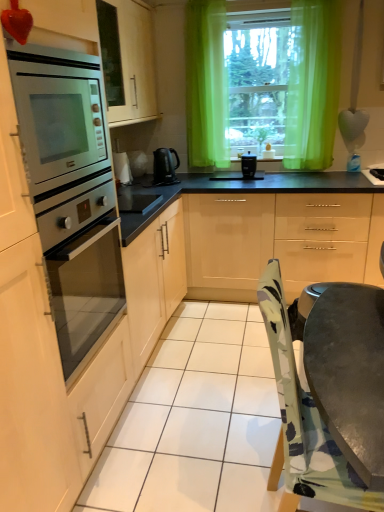
Question: Is green sheer curtains at upper center oriented away from black plastic coffee maker at center?

Choices:
 (A) yes
 (B) no

Answer: (B)

Question: Does green sheer curtains at upper center have a smaller size compared to black plastic coffee maker at center?

Choices:
 (A) no
 (B) yes

Answer: (A)

Question: From the image's perspective, is green sheer curtains at upper center on top of black plastic coffee maker at center?

Choices:
 (A) no
 (B) yes

Answer: (B)

Question: Is the position of green sheer curtains at upper center less distant than that of black plastic coffee maker at center?

Choices:
 (A) no
 (B) yes

Answer: (B)

Question: Can we say green sheer curtains at upper center lies outside black plastic coffee maker at center?

Choices:
 (A) yes
 (B) no

Answer: (A)

Question: From the image's perspective, is green sheer curtain at upper center located above or below black glass cooktop at center?

Choices:
 (A) below
 (B) above

Answer: (B)

Question: Considering the positions of point (299, 167) and point (120, 202), is point (299, 167) closer or farther from the camera than point (120, 202)?

Choices:
 (A) closer
 (B) farther

Answer: (B)

Question: Considering the positions of green sheer curtain at upper center and black glass cooktop at center in the image, is green sheer curtain at upper center bigger or smaller than black glass cooktop at center?

Choices:
 (A) big
 (B) small

Answer: (A)

Question: Considering the positions of green sheer curtain at upper center and black glass cooktop at center in the image, is green sheer curtain at upper center taller or shorter than black glass cooktop at center?

Choices:
 (A) short
 (B) tall

Answer: (B)

Question: From the image's perspective, is green sheer curtains at upper center located above or below black glass cooktop at center?

Choices:
 (A) below
 (B) above

Answer: (B)

Question: Based on their positions, is green sheer curtains at upper center located to the left or right of black glass cooktop at center?

Choices:
 (A) right
 (B) left

Answer: (A)

Question: Based on their sizes in the image, would you say green sheer curtains at upper center is bigger or smaller than black glass cooktop at center?

Choices:
 (A) big
 (B) small

Answer: (A)

Question: Relative to black glass cooktop at center, is green sheer curtains at upper center in front or behind?

Choices:
 (A) behind
 (B) front

Answer: (A)

Question: Looking at their shapes, would you say glossy beige cabinets at center is wider or thinner than black glass cooktop at center?

Choices:
 (A) thin
 (B) wide

Answer: (B)

Question: Looking at the image, does glossy beige cabinets at center seem bigger or smaller compared to black glass cooktop at center?

Choices:
 (A) big
 (B) small

Answer: (A)